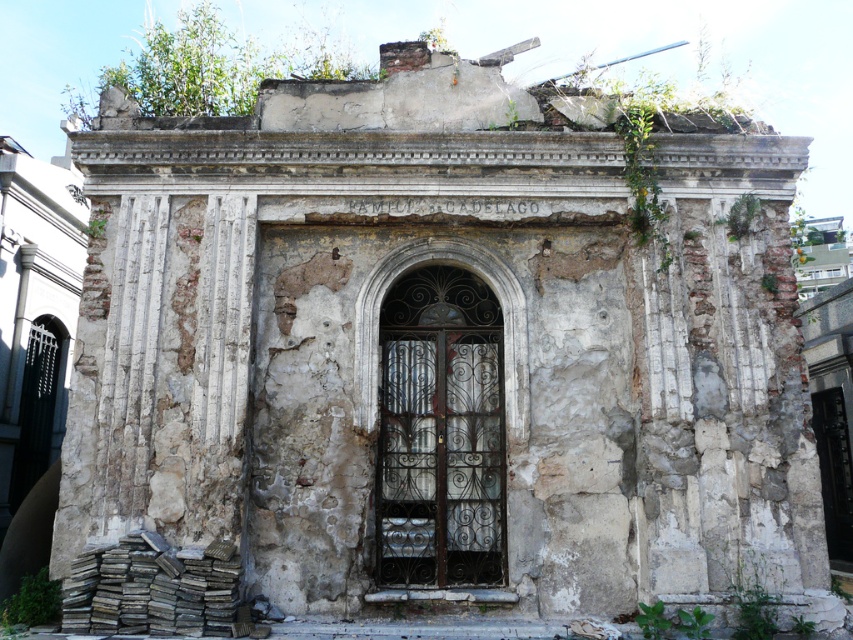
Based on the coordinates provided, which object in the scene is located at point (32, 600)?

The green leafy vegetation at lower left is located at point (32, 600).

You are a gardener tasked with maintaining the plants around the mausoleum. You notice two green leafy plants growing near the structure. Which one is bigger between the green leafy plant at upper right and the green leafy weed at lower right?

The green leafy plant at upper right is larger in size compared to the green leafy weed at lower right.

You are standing in front of the old mausoleum and notice green leafy vegetation at lower left. If you want to reach the vegetation without moving your feet, can you just stretch your arm out?

The green leafy vegetation at lower left is 55.13 feet away from you, so you cannot reach it by stretching your arm out since that distance is far beyond an average person arm length.